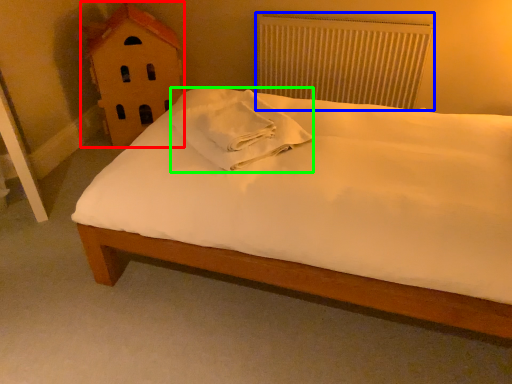
Question: Based on their relative distances, which object is farther from toy (highlighted by a red box)? Choose from radiator (highlighted by a blue box) and material (highlighted by a green box).

Choices:
 (A) radiator
 (B) material

Answer: (A)